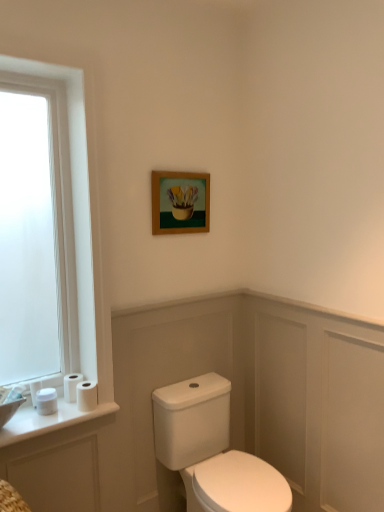
Image resolution: width=384 pixels, height=512 pixels. What are the coordinates of `vacant area located to the right-hand side of white matte toilet paper at lower left, the second toilet paper positioned from the left` in the screenshot? It's located at (72, 408).